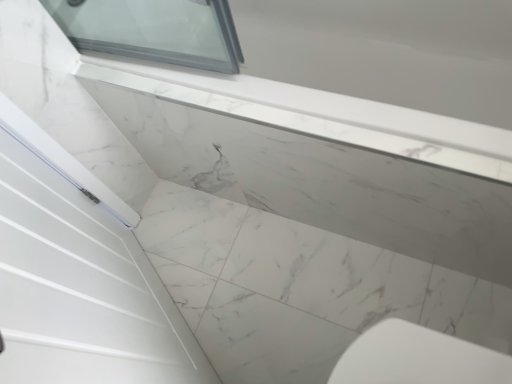
In order to click on vacant space that is to the left of white marble window sill at upper center in this screenshot , I will do `click(232, 261)`.